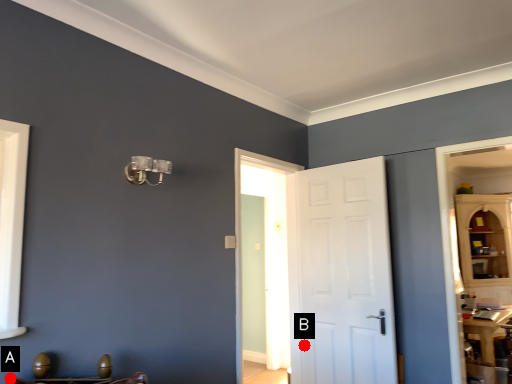
Question: Two points are circled on the image, labeled by A and B beside each circle. Which point is closer to the camera taking this photo?

Choices:
 (A) A is closer
 (B) B is closer

Answer: (A)